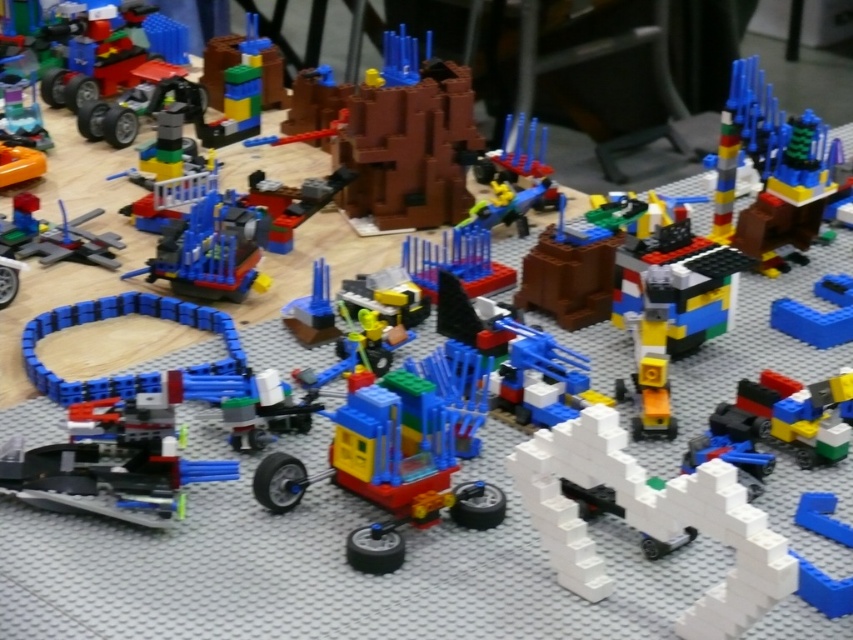
You are a Lego enthusiast trying to build a structure that requires a gear to fit under a vehicle. Given the translucent yellow car at center and the translucent blue plastic gear at center, will the gear fit under the car based on their sizes?

The translucent yellow car at center is taller than the translucent blue plastic gear at center, so the gear will fit under the car since it is shorter in height.